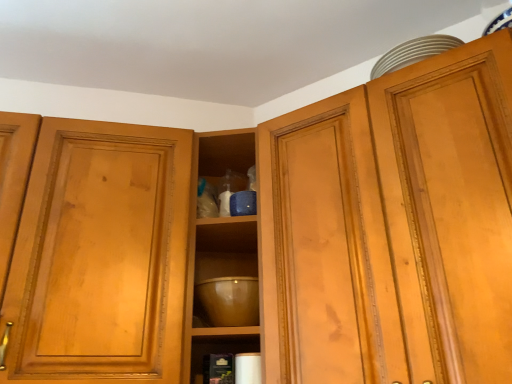
What do you see at coordinates (230, 300) in the screenshot? I see `glossy ceramic mixing bowl at center` at bounding box center [230, 300].

The image size is (512, 384). Find the location of `glossy ceramic mixing bowl at center`. glossy ceramic mixing bowl at center is located at coordinates (230, 300).

This screenshot has width=512, height=384. I want to click on transparent glass cabinet at upper center, so click(x=100, y=255).

This screenshot has height=384, width=512. What are the coordinates of `glossy ceramic mixing bowl at center` in the screenshot? It's located at (230, 300).

From their relative heights in the image, would you say transparent glass cabinet at upper center is taller or shorter than matte wood cabinet at upper right?

In the image, transparent glass cabinet at upper center appears to be shorter than matte wood cabinet at upper right.

How many degrees apart are the facing directions of transparent glass cabinet at upper center and matte wood cabinet at upper right?

They differ by 44.9 degrees in their facing directions.

Does point (139, 233) come farther from viewer compared to point (480, 45)?

Yes, point (139, 233) is farther from viewer.

Which of these two, transparent glass cabinet at upper center or glossy ceramic mixing bowl at center, stands shorter?

glossy ceramic mixing bowl at center is shorter.

Is transparent glass cabinet at upper center closer to the viewer compared to glossy ceramic mixing bowl at center?

Yes, it is.

Could you tell me if transparent glass cabinet at upper center is turned towards glossy ceramic mixing bowl at center?

Yes, transparent glass cabinet at upper center is oriented towards glossy ceramic mixing bowl at center.

Is matte wood cabinet at upper right turned away from transparent glass cabinet at upper center?

That's not correct — matte wood cabinet at upper right is not looking away from transparent glass cabinet at upper center.

Considering the sizes of objects matte wood cabinet at upper right and transparent glass cabinet at upper center in the image provided, who is taller, matte wood cabinet at upper right or transparent glass cabinet at upper center?

matte wood cabinet at upper right.

In order to click on glass door that appears on the left of matte wood cabinet at upper right in this screenshot , I will do click(100, 255).

Is matte wood cabinet at upper right wider than transparent glass cabinet at upper center?

Yes.

Looking at this image, what's the angular difference between glossy ceramic mixing bowl at center and transparent glass cabinet at upper center's facing directions?

There is a 17.3-degree angle between the facing directions of glossy ceramic mixing bowl at center and transparent glass cabinet at upper center.

Is glossy ceramic mixing bowl at center located outside transparent glass cabinet at upper center?

Actually, glossy ceramic mixing bowl at center is at least partially inside transparent glass cabinet at upper center.

Locate an element on the screen. The width and height of the screenshot is (512, 384). mixing bowl lying behind the transparent glass cabinet at upper center is located at coordinates [x=230, y=300].

Is glossy ceramic mixing bowl at center shorter than transparent glass cabinet at upper center?

Yes, glossy ceramic mixing bowl at center is shorter than transparent glass cabinet at upper center.

Between glossy ceramic mixing bowl at center and matte wood cabinet at upper right, which one has more height?

Standing taller between the two is matte wood cabinet at upper right.

I want to click on mixing bowl below the matte wood cabinet at upper right (from a real-world perspective), so click(x=230, y=300).

In terms of width, does glossy ceramic mixing bowl at center look wider or thinner when compared to matte wood cabinet at upper right?

In the image, glossy ceramic mixing bowl at center appears to be more narrow than matte wood cabinet at upper right.

From the image's perspective, who appears lower, matte wood cabinet at upper right or glossy ceramic mixing bowl at center?

glossy ceramic mixing bowl at center appears lower in the image.

Between matte wood cabinet at upper right and glossy ceramic mixing bowl at center, which one appears on the left side from the viewer's perspective?

glossy ceramic mixing bowl at center.

From a real-world perspective, does matte wood cabinet at upper right sit lower than glossy ceramic mixing bowl at center?

No, from a real-world perspective, matte wood cabinet at upper right is not under glossy ceramic mixing bowl at center.

Which is behind, point (507, 200) or point (211, 284)?

The point (211, 284) is farther from the camera.

This screenshot has height=384, width=512. Identify the location of cabinetry that appears above the transparent glass cabinet at upper center (from the image's perspective). coord(398,225).

You are a GUI agent. You are given a task and a screenshot of the screen. Output one action in this format:
    pyautogui.click(x=<x>, y=<y>)
    Task: Click on the glass door that is above the glossy ceramic mixing bowl at center (from a real-world perspective)
    
    Given the screenshot: What is the action you would take?
    pyautogui.click(x=100, y=255)

Considering their positions, is transparent glass cabinet at upper center positioned further to matte wood cabinet at upper right than glossy ceramic mixing bowl at center?

The object further to matte wood cabinet at upper right is transparent glass cabinet at upper center.

From the image, which object appears to be nearer to glossy ceramic mixing bowl at center, matte wood cabinet at upper right or transparent glass cabinet at upper center?

transparent glass cabinet at upper center is positioned closer to the anchor glossy ceramic mixing bowl at center.

Which object lies further to the anchor point transparent glass cabinet at upper center, matte wood cabinet at upper right or glossy ceramic mixing bowl at center?

Among the two, matte wood cabinet at upper right is located further to transparent glass cabinet at upper center.

Looking at the image, which one is located closer to glossy ceramic mixing bowl at center, transparent glass cabinet at upper center or matte wood cabinet at upper right?

The object closer to glossy ceramic mixing bowl at center is transparent glass cabinet at upper center.

Based on their spatial positions, is glossy ceramic mixing bowl at center or matte wood cabinet at upper right further from transparent glass cabinet at upper center?

Based on the image, matte wood cabinet at upper right appears to be further to transparent glass cabinet at upper center.

From the image, which object appears to be nearer to matte wood cabinet at upper right, glossy ceramic mixing bowl at center or transparent glass cabinet at upper center?

The object closer to matte wood cabinet at upper right is glossy ceramic mixing bowl at center.

Identify the location of mixing bowl situated between transparent glass cabinet at upper center and matte wood cabinet at upper right from left to right. (230, 300).